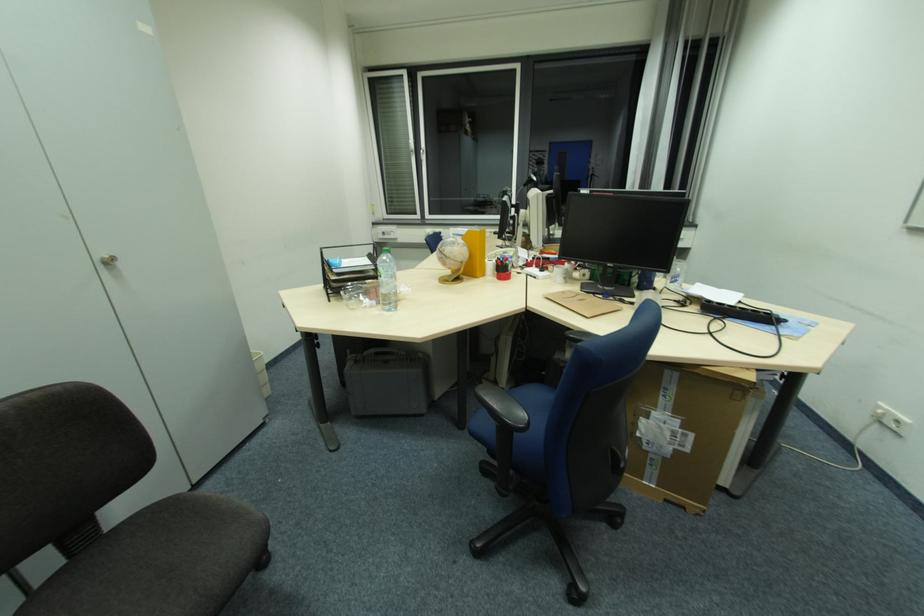
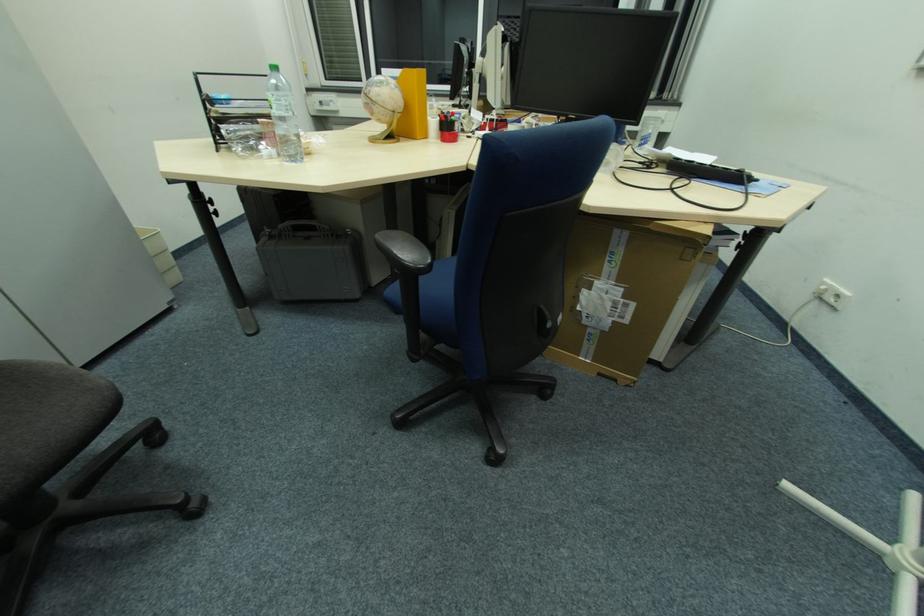
Which direction would the cameraman need to move to produce the second image?

The movement direction of the cameraman is right, forward.